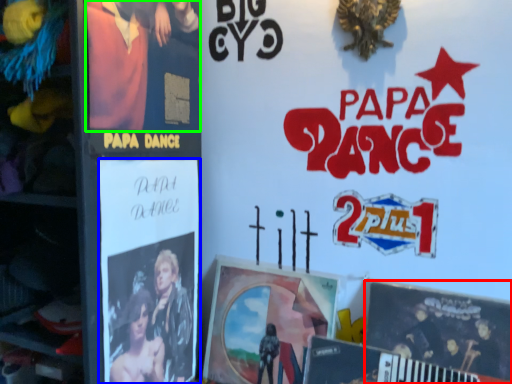
Question: Which object is the closest to the poster (highlighted by a red box)? Choose among these: poster (highlighted by a blue box) or person (highlighted by a green box).

Choices:
 (A) poster
 (B) person

Answer: (A)